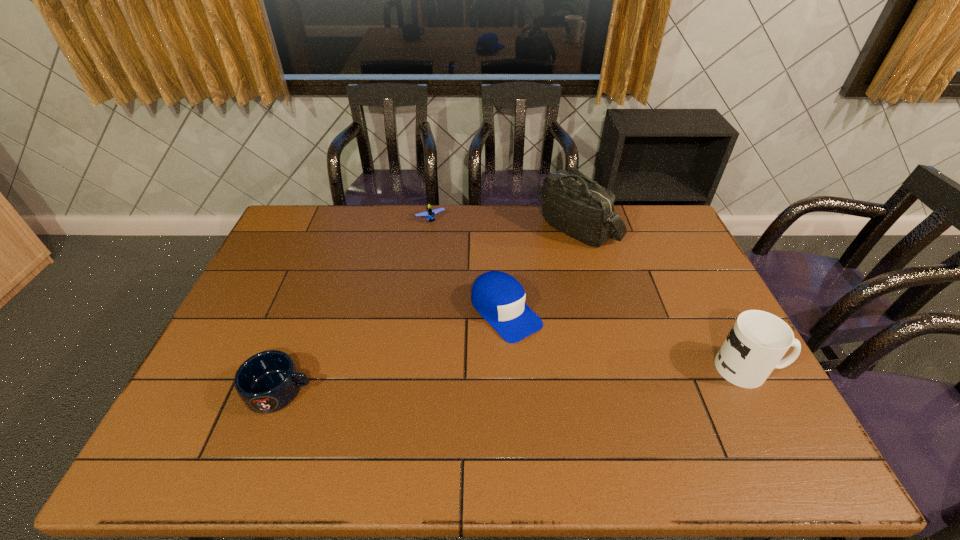
The height and width of the screenshot is (540, 960). In the image, there is a desktop. Identify the location of vacant space at the far right corner. (654, 218).

I want to click on free region at the near right corner, so click(753, 401).

Where is `free area in between the left mug and the third shortest object`? This screenshot has width=960, height=540. free area in between the left mug and the third shortest object is located at coordinates (393, 352).

The image size is (960, 540). What are the coordinates of `empty space that is in between the third farthest object and the leftmost object` in the screenshot? It's located at tap(393, 352).

This screenshot has width=960, height=540. I want to click on free space between the third farthest object and the shorter mug, so click(393, 352).

I want to click on unoccupied position between the rightmost object and the shortest object, so click(x=589, y=294).

This screenshot has height=540, width=960. I want to click on vacant space that's between the baseball cap and the second object from left to right, so click(x=468, y=266).

Locate an element on the screen. This screenshot has width=960, height=540. free space that is in between the taller mug and the second shortest object is located at coordinates (514, 380).

Where is `vacant area that lies between the left mug and the tallest object`? Image resolution: width=960 pixels, height=540 pixels. vacant area that lies between the left mug and the tallest object is located at coordinates (429, 309).

Locate an element on the screen. free space between the tallest object and the baseball cap is located at coordinates (542, 270).